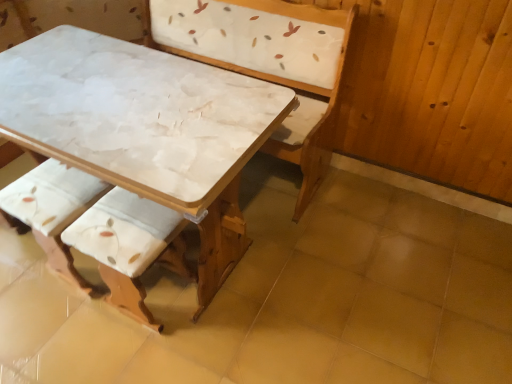
The height and width of the screenshot is (384, 512). Identify the location of free location in front of white fabric cushion at lower left, which is the 2th armchair from right to left. (59, 330).